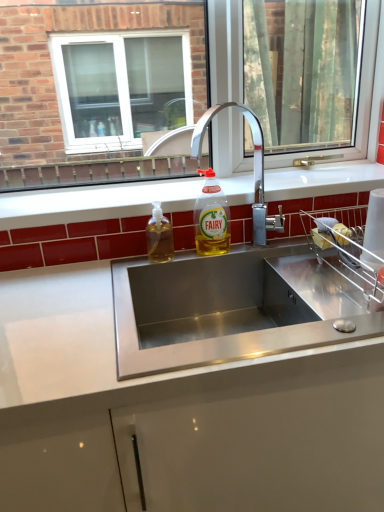
What do you see at coordinates (159, 236) in the screenshot? This screenshot has width=384, height=512. I see `translucent plastic soap dispenser at sink left, which appears as the 1th bottle when viewed from the left` at bounding box center [159, 236].

Identify the location of translucent plastic soap dispenser at sink left, which appears as the 1th bottle when viewed from the left. The height and width of the screenshot is (512, 384). (159, 236).

What is the approximate width of white glossy countertop at center?

white glossy countertop at center is 24.53 inches wide.

Measure the distance between point (15, 399) and camera.

The distance of point (15, 399) from camera is 71.50 centimeters.

In order to face yellow translucent liquid at sink center, which ranks as the 2th bottle in left-to-right order, should I rotate leftwards or rightwards?

To align with it, rotate right about 3.005°.

Describe the element at coordinates (254, 170) in the screenshot. I see `chrome metallic faucet at center` at that location.

You are a GUI agent. You are given a task and a screenshot of the screen. Output one action in this format:
    pyautogui.click(x=<x>, y=<y>)
    Task: Click on the stainless steel sink at center
    The height and width of the screenshot is (512, 384).
    Given the screenshot: What is the action you would take?
    pyautogui.click(x=202, y=313)

Which object is positioned more to the right, yellow translucent liquid at sink center, which ranks as the 2th bottle in left-to-right order, or white glossy countertop at center?

white glossy countertop at center.

Are yellow translucent liquid at sink center, which appears as the first bottle when viewed from the right, and white glossy countertop at center far apart?

No, there isn't a large distance between yellow translucent liquid at sink center, which appears as the first bottle when viewed from the right, and white glossy countertop at center.

Locate an element on the screen. The height and width of the screenshot is (512, 384). countertop that is under the yellow translucent liquid at sink center, which ranks as the 2th bottle in left-to-right order (from a real-world perspective) is located at coordinates (58, 334).

Is stainless steel sink at center placed right next to clear glass window at center?

stainless steel sink at center and clear glass window at center are not in contact.

I want to click on window on the left of stainless steel sink at center, so click(x=51, y=66).

Is stainless steel sink at center inside the boundaries of clear glass window at center, or outside?

stainless steel sink at center exists outside the volume of clear glass window at center.

Can you tell me how much stainless steel sink at center and clear glass window at center differ in facing direction?

There is a 0.154-degree angle between the facing directions of stainless steel sink at center and clear glass window at center.

From the picture: Can you tell me how much yellow translucent liquid at sink center, which ranks as the 2th bottle in left-to-right order, and stainless steel sink at center differ in facing direction?

1.87 degrees separate the facing orientations of yellow translucent liquid at sink center, which ranks as the 2th bottle in left-to-right order, and stainless steel sink at center.

Image resolution: width=384 pixels, height=512 pixels. Find the location of `bottle located on the right of stainless steel sink at center`. bottle located on the right of stainless steel sink at center is located at coordinates (211, 217).

Which object is further away from the camera taking this photo, yellow translucent liquid at sink center, which appears as the first bottle when viewed from the right, or stainless steel sink at center?

A: yellow translucent liquid at sink center, which appears as the first bottle when viewed from the right, is further from the camera.

Considering their positions, is translucent plastic soap dispenser at sink left, the 2th bottle in the right-to-left sequence, located in front of or behind chrome metallic faucet at center?

In the image, translucent plastic soap dispenser at sink left, the 2th bottle in the right-to-left sequence, appears behind chrome metallic faucet at center.

From a real-world perspective, is translucent plastic soap dispenser at sink left, the 2th bottle in the right-to-left sequence, positioned over chrome metallic faucet at center based on gravity?

No, from a real-world perspective, translucent plastic soap dispenser at sink left, the 2th bottle in the right-to-left sequence, is not on top of chrome metallic faucet at center.

In the image, is translucent plastic soap dispenser at sink left, the 2th bottle in the right-to-left sequence, on the left side or the right side of chrome metallic faucet at center?

Clearly, translucent plastic soap dispenser at sink left, the 2th bottle in the right-to-left sequence, is on the left of chrome metallic faucet at center in the image.

Does translucent plastic soap dispenser at sink left, which appears as the 1th bottle when viewed from the left, have a lesser width compared to chrome metallic faucet at center?

Yes.

From the picture: Does clear glass window at center have a larger size compared to stainless steel sink at center?

No, clear glass window at center is not bigger than stainless steel sink at center.

Is stainless steel sink at center a part of clear glass window at center?

No.

From the image's perspective, which one is positioned higher, clear glass window at center or stainless steel sink at center?

From the image's view, clear glass window at center is above.

Is chrome metallic faucet at center at the back of white glossy countertop at center?

white glossy countertop at center is not turned away from chrome metallic faucet at center.

Which is more to the left, white glossy countertop at center or chrome metallic faucet at center?

Positioned to the left is white glossy countertop at center.

Is white glossy countertop at center far away from chrome metallic faucet at center?

white glossy countertop at center is near chrome metallic faucet at center, not far away.

Looking at this image, which object is positioned more to the right, white glossy countertop at center or translucent plastic soap dispenser at sink left, which appears as the 1th bottle when viewed from the left?

From the viewer's perspective, white glossy countertop at center appears more on the right side.

I want to click on the 1st bottle positioned above the white glossy countertop at center (from a real-world perspective), so click(159, 236).

Based on the photo, does white glossy countertop at center contain translucent plastic soap dispenser at sink left, the 2th bottle in the right-to-left sequence?

No, translucent plastic soap dispenser at sink left, the 2th bottle in the right-to-left sequence, is not a part of white glossy countertop at center.

Does white glossy countertop at center come behind translucent plastic soap dispenser at sink left, which appears as the 1th bottle when viewed from the left?

No, white glossy countertop at center is in front of translucent plastic soap dispenser at sink left, which appears as the 1th bottle when viewed from the left.

Where is `countertop below the yellow translucent liquid at sink center, which appears as the first bottle when viewed from the right (from a real-world perspective)`? countertop below the yellow translucent liquid at sink center, which appears as the first bottle when viewed from the right (from a real-world perspective) is located at coordinates (58, 334).

What are the coordinates of `window positioned vertically above the stainless steel sink at center (from a real-world perspective)` in the screenshot? It's located at (51, 66).

Looking at the image, which one is located closer to chrome metallic faucet at center, translucent plastic soap dispenser at sink left, which appears as the 1th bottle when viewed from the left, or yellow translucent liquid at sink center, which appears as the first bottle when viewed from the right?

yellow translucent liquid at sink center, which appears as the first bottle when viewed from the right, lies closer to chrome metallic faucet at center than the other object.

Estimate the real-world distances between objects in this image. Which object is further from stainless steel sink at center, chrome metallic faucet at center or translucent plastic soap dispenser at sink left, the 2th bottle in the right-to-left sequence?

chrome metallic faucet at center is positioned further to the anchor stainless steel sink at center.

From the image, which object appears to be farther from stainless steel sink at center, translucent plastic soap dispenser at sink left, the 2th bottle in the right-to-left sequence, or clear glass window at center?

Based on the image, clear glass window at center appears to be further to stainless steel sink at center.

Based on their spatial positions, is yellow translucent liquid at sink center, which ranks as the 2th bottle in left-to-right order, or chrome metallic faucet at center further from translucent plastic soap dispenser at sink left, which appears as the 1th bottle when viewed from the left?

Among the two, chrome metallic faucet at center is located further to translucent plastic soap dispenser at sink left, which appears as the 1th bottle when viewed from the left.

Considering their positions, is clear glass window at center positioned closer to stainless steel sink at center than white glossy countertop at center?

The object closer to stainless steel sink at center is white glossy countertop at center.

Estimate the real-world distances between objects in this image. Which object is further from white glossy countertop at center, translucent plastic soap dispenser at sink left, which appears as the 1th bottle when viewed from the left, or yellow translucent liquid at sink center, which appears as the first bottle when viewed from the right?

yellow translucent liquid at sink center, which appears as the first bottle when viewed from the right, is further to white glossy countertop at center.

Considering their positions, is stainless steel sink at center positioned closer to clear glass window at center than white glossy countertop at center?

Based on the image, stainless steel sink at center appears to be nearer to clear glass window at center.

Estimate the real-world distances between objects in this image. Which object is further from white glossy countertop at center, translucent plastic soap dispenser at sink left, the 2th bottle in the right-to-left sequence, or clear glass window at center?

clear glass window at center is further to white glossy countertop at center.

At what (x,y) coordinates should I click in order to perform the action: click on bottle between yellow translucent liquid at sink center, which ranks as the 2th bottle in left-to-right order, and white glossy countertop at center in the up-down direction. Please return your answer as a coordinate pair (x, y). This screenshot has width=384, height=512. Looking at the image, I should click on (159, 236).

At what (x,y) coordinates should I click in order to perform the action: click on tap that lies between clear glass window at center and stainless steel sink at center from top to bottom. Please return your answer as a coordinate pair (x, y). This screenshot has height=512, width=384. Looking at the image, I should click on (254, 170).

This screenshot has width=384, height=512. What are the coordinates of `bottle between stainless steel sink at center and chrome metallic faucet at center from left to right` in the screenshot? It's located at (211, 217).

Identify the location of sink between clear glass window at center and translucent plastic soap dispenser at sink left, the 2th bottle in the right-to-left sequence, vertically. Image resolution: width=384 pixels, height=512 pixels. (202, 313).